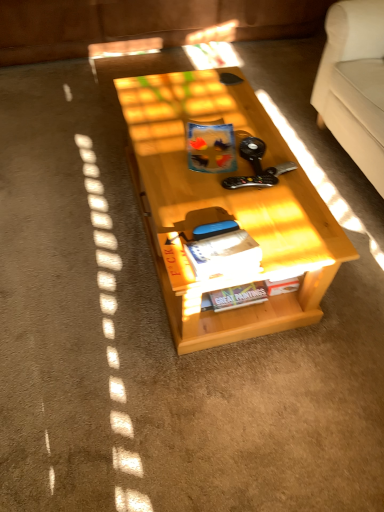
Locate an element on the screen. The width and height of the screenshot is (384, 512). vacant space that is in between hardcover book at center, which appears as the first book when viewed from the front, and matte plastic book at center, which ranks as the 1th book in top-to-bottom order is located at coordinates (211, 202).